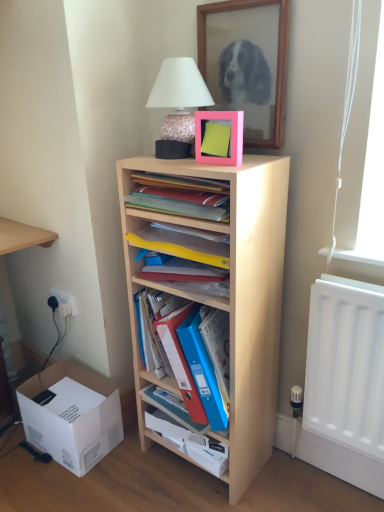
The image size is (384, 512). Identify the location of blank area to the left of pink matte picture frame at upper center. (179, 160).